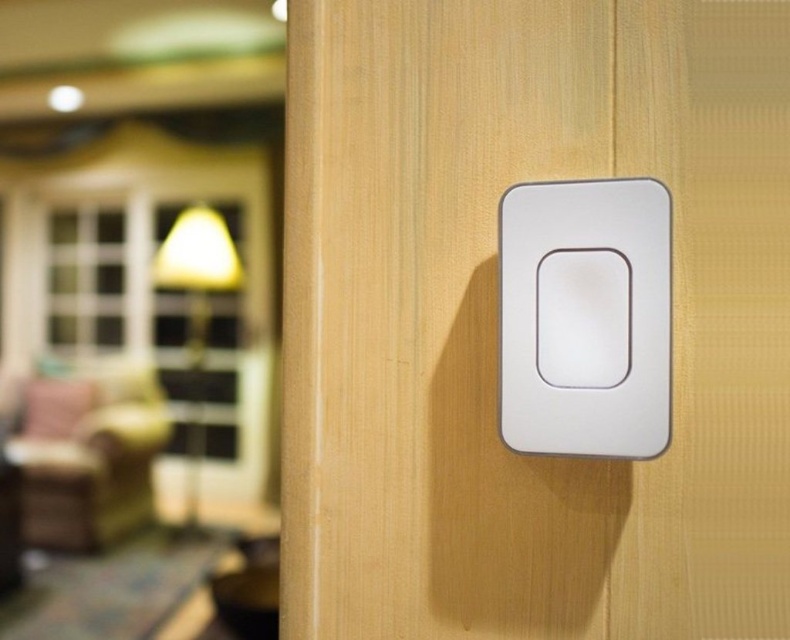
You are moving a small plant stand into the room and need to place it between the velvet pink armchair at left and the matte yellow lampshade at left. Which object should you position the plant stand closer to if you want to maximize the available space?

You should position the plant stand closer to the velvet pink armchair at left because it occupies less space than the matte yellow lampshade at left, leaving more room between them.

You are standing in front of the wooden door with the modern light switch. There are two points marked on the door. One is at coordinate point [646,248] and the other is at point [194,284]. Which point is closer to you?

Point [646,248] is closer to the viewer than point [194,284].

You are standing in front of a wooden door and notice the white matte switch at center and the matte yellow lampshade at left. Which object is closer to you?

The white matte switch at center is closer to you because it is in front of the matte yellow lampshade at left.